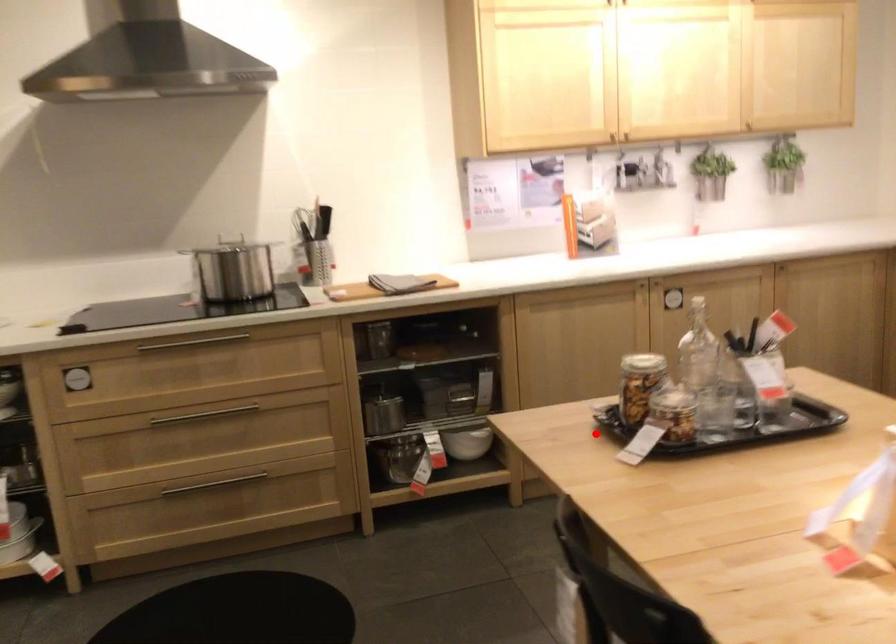
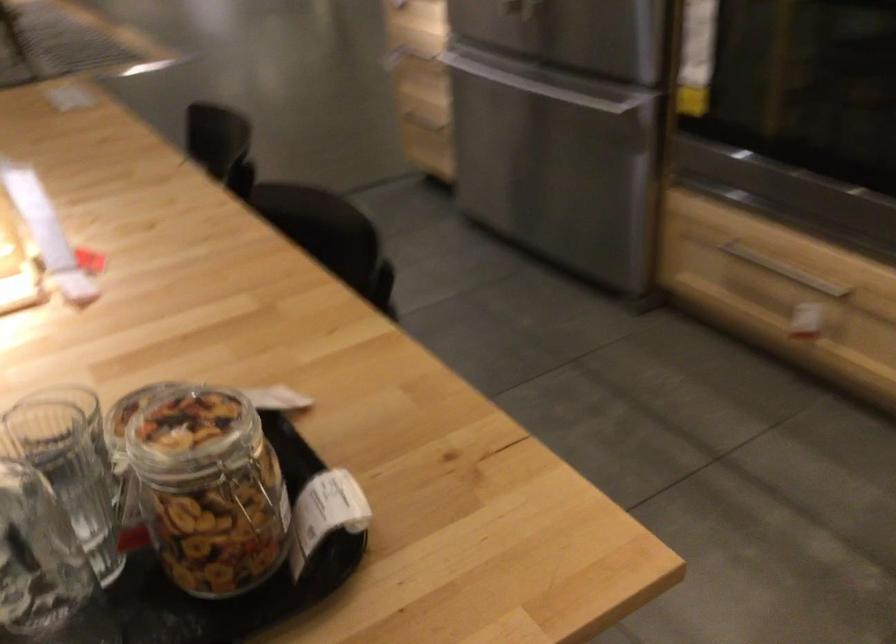
Question: A red point is marked in image1. In image2, is the corresponding 3D point closer to the camera or farther? Reply with the corresponding letter.

Choices:
 (A) The corresponding 3D point is closer.
 (B) The corresponding 3D point is farther.

Answer: (A)